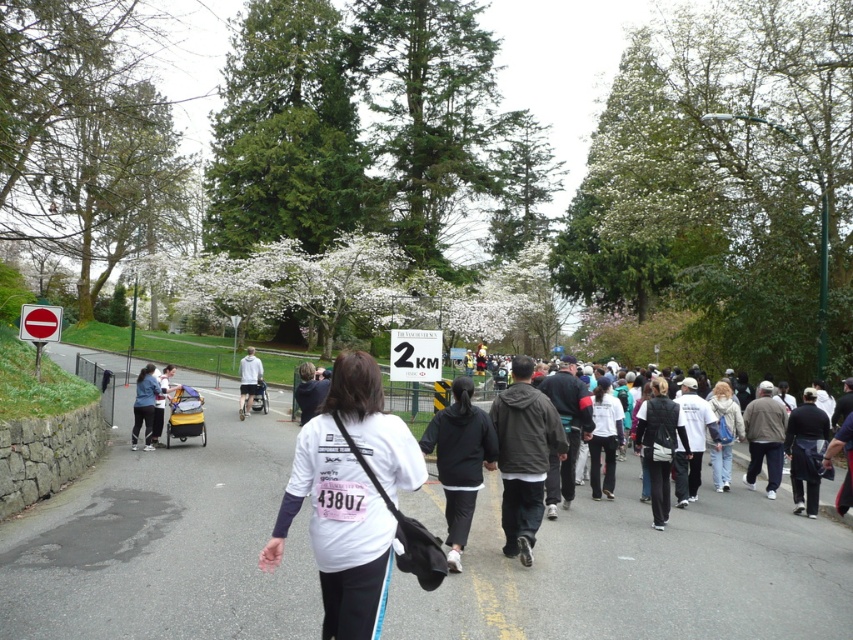
Question: Which point is closer to the camera taking this photo?

Choices:
 (A) (456, 500)
 (B) (293, 577)

Answer: (B)

Question: Which object is positioned farthest from the white matte shirt at center?

Choices:
 (A) black matte sweatshirt at center
 (B) black fabric jacket at center
 (C) white fabric shirt at center

Answer: (B)

Question: Observing the image, what is the correct spatial positioning of white fabric shirt at center in reference to black matte sweatshirt at center?

Choices:
 (A) below
 (B) above

Answer: (A)

Question: Based on their relative distances, which object is nearer to the white matte jacket at center?

Choices:
 (A) white matte shirt at center
 (B) white fabric shirt at center
 (C) black matte sweatshirt at center
 (D) white fuzzy jacket at right

Answer: (D)

Question: Can you confirm if black fabric jacket at center is smaller than white fuzzy jacket at right?

Choices:
 (A) no
 (B) yes

Answer: (B)

Question: Does white matte shirt at center have a larger size compared to black fabric jacket at center?

Choices:
 (A) yes
 (B) no

Answer: (B)